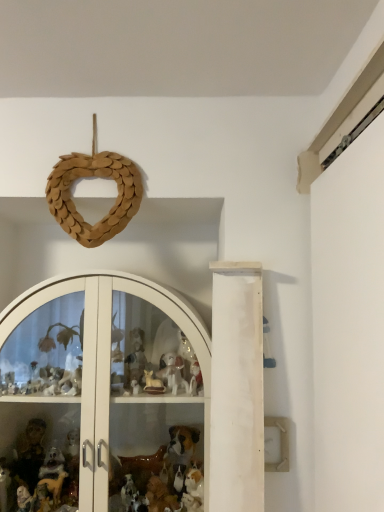
I want to click on wooden heart at upper center, so click(94, 176).

Describe the element at coordinates (94, 176) in the screenshot. I see `wooden heart at upper center` at that location.

Find the location of `white glossy glass door at center`. white glossy glass door at center is located at coordinates (103, 399).

Describe the element at coordinates (103, 399) in the screenshot. This screenshot has width=384, height=512. I see `white glossy glass door at center` at that location.

Locate an element on the screen. This screenshot has height=512, width=384. wooden heart at upper center is located at coordinates (94, 176).

Can you confirm if wooden heart at upper center is positioned to the left of white glossy glass door at center?

In fact, wooden heart at upper center is to the right of white glossy glass door at center.

Is wooden heart at upper center in front of or behind white glossy glass door at center in the image?

wooden heart at upper center is behind white glossy glass door at center.

Which is in front, point (61, 198) or point (58, 425)?

The point (61, 198) is more forward.

From the image's perspective, which is above, wooden heart at upper center or white glossy glass door at center?

wooden heart at upper center.

From a real-world perspective, relative to white glossy glass door at center, is wooden heart at upper center vertically above or below?

From a real-world perspective, wooden heart at upper center is physically above white glossy glass door at center.

Considering the sizes of objects wooden heart at upper center and white glossy glass door at center in the image provided, who is thinner, wooden heart at upper center or white glossy glass door at center?

wooden heart at upper center is thinner.

Between wooden heart at upper center and white glossy glass door at center, which one has less height?

With less height is wooden heart at upper center.

Considering the relative sizes of wooden heart at upper center and white glossy glass door at center in the image provided, is wooden heart at upper center bigger than white glossy glass door at center?

Incorrect, wooden heart at upper center is not larger than white glossy glass door at center.

Would you say wooden heart at upper center is outside white glossy glass door at center?

Yes, wooden heart at upper center is located beyond the bounds of white glossy glass door at center.

Can you see wooden heart at upper center touching white glossy glass door at center?

No, wooden heart at upper center is not in contact with white glossy glass door at center.

Is wooden heart at upper center looking in the opposite direction of white glossy glass door at center?

No, white glossy glass door at center is not at the back of wooden heart at upper center.

Find the location of a particular element. toy located behind the white glossy glass door at center is located at coordinates (94, 176).

Based on their positions, is white glossy glass door at center located to the left or right of wooden heart at upper center?

Clearly, white glossy glass door at center is on the left of wooden heart at upper center in the image.

Which object is further away from the camera taking this photo, white glossy glass door at center or wooden heart at upper center?

wooden heart at upper center is further from the camera.

Considering the positions of point (146, 507) and point (57, 170), is point (146, 507) closer or farther from the camera than point (57, 170)?

Point (146, 507) appears to be farther away from the viewer than point (57, 170).

From the image's perspective, which is above, white glossy glass door at center or wooden heart at upper center?

wooden heart at upper center appears higher in the image.

From a real-world perspective, does white glossy glass door at center stand above wooden heart at upper center?

No, from a real-world perspective, white glossy glass door at center is not over wooden heart at upper center

Considering the relative sizes of white glossy glass door at center and wooden heart at upper center in the image provided, is white glossy glass door at center wider than wooden heart at upper center?

Correct, the width of white glossy glass door at center exceeds that of wooden heart at upper center.

Between white glossy glass door at center and wooden heart at upper center, which one has more height?

white glossy glass door at center.

Which of these two, white glossy glass door at center or wooden heart at upper center, is bigger?

Bigger between the two is white glossy glass door at center.

Do you think white glossy glass door at center is within wooden heart at upper center, or outside of it?

white glossy glass door at center is not enclosed by wooden heart at upper center.

Is the surface of white glossy glass door at center in direct contact with wooden heart at upper center?

white glossy glass door at center and wooden heart at upper center are clearly separated.

Is white glossy glass door at center aimed at wooden heart at upper center?

No, white glossy glass door at center is not aimed at wooden heart at upper center.

Measure the distance between white glossy glass door at center and wooden heart at upper center.

A distance of 47.19 centimeters exists between white glossy glass door at center and wooden heart at upper center.

What are the coordinates of `glass door that is below the wooden heart at upper center (from the image's perspective)` in the screenshot? It's located at (103, 399).

Find the location of a particular element. glass door that appears below the wooden heart at upper center (from the image's perspective) is located at coordinates (103, 399).

Find the location of `glass door on the left of wooden heart at upper center`. glass door on the left of wooden heart at upper center is located at coordinates (103, 399).